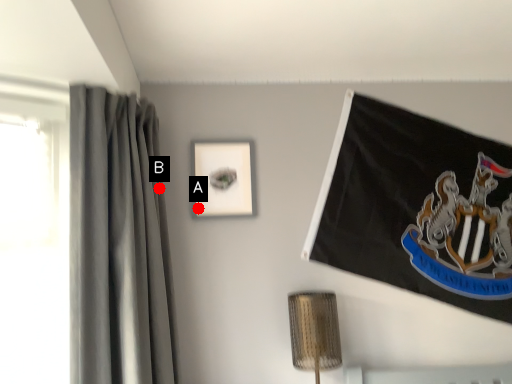
Question: Two points are circled on the image, labeled by A and B beside each circle. Which point appears farthest from the camera in this image?

Choices:
 (A) A is further
 (B) B is further

Answer: (A)